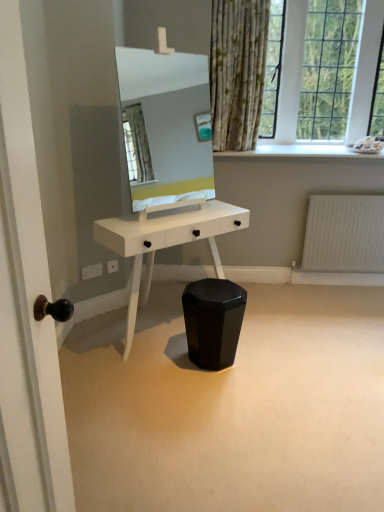
Question: Does black glossy stool at center touch white glossy mirror at center?

Choices:
 (A) yes
 (B) no

Answer: (B)

Question: Does black glossy stool at center appear on the left side of white glossy mirror at center?

Choices:
 (A) yes
 (B) no

Answer: (B)

Question: Is black glossy stool at center looking in the opposite direction of white glossy mirror at center?

Choices:
 (A) no
 (B) yes

Answer: (A)

Question: Is black glossy stool at center oriented towards white glossy mirror at center?

Choices:
 (A) yes
 (B) no

Answer: (B)

Question: Can you confirm if black glossy stool at center is smaller than white glossy mirror at center?

Choices:
 (A) no
 (B) yes

Answer: (A)

Question: From the image's perspective, is black glossy stool at center below white glossy mirror at center?

Choices:
 (A) no
 (B) yes

Answer: (B)

Question: Is white glossy mirror at center outside black glossy stool at center?

Choices:
 (A) yes
 (B) no

Answer: (A)

Question: Is white glossy mirror at center closer to camera compared to black glossy stool at center?

Choices:
 (A) yes
 (B) no

Answer: (A)

Question: From the image's perspective, does white glossy mirror at center appear higher than black glossy stool at center?

Choices:
 (A) no
 (B) yes

Answer: (B)

Question: Does white glossy mirror at center come behind black glossy stool at center?

Choices:
 (A) no
 (B) yes

Answer: (A)

Question: From the image's perspective, would you say white glossy mirror at center is shown under black glossy stool at center?

Choices:
 (A) no
 (B) yes

Answer: (A)

Question: Could you tell me if white glossy mirror at center is turned towards black glossy stool at center?

Choices:
 (A) yes
 (B) no

Answer: (B)

Question: Does white matte radiator at lower right have a greater height compared to black glossy stool at center?

Choices:
 (A) no
 (B) yes

Answer: (B)